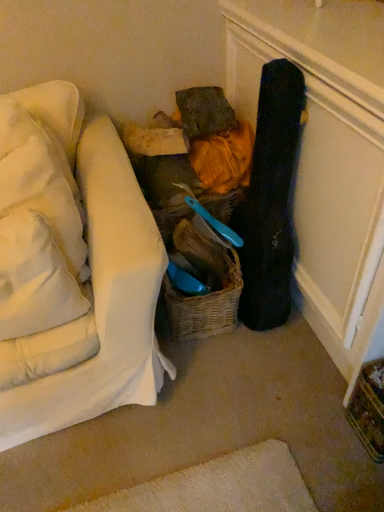
What is the approximate width of woven brown basket at center, placed as the first basket when sorted from top to bottom?

woven brown basket at center, placed as the first basket when sorted from top to bottom, is 8.31 inches in width.

In order to face woven brown basket at center, placed as the first basket when sorted from bottom to top, should I rotate leftwards or rightwards?

Turn right approximately 0.980 degrees to face it.

Describe the element at coordinates (34, 279) in the screenshot. I see `white soft pillow at left, positioned as the third pillow in top-to-bottom order` at that location.

Image resolution: width=384 pixels, height=512 pixels. Identify the location of white soft pillow at left, arranged as the 2th pillow when ordered from the bottom. (40, 179).

Measure the distance between white soft pillow at left, arranged as the 2th pillow when ordered from the bottom, and camera.

3.37 feet.

Find the location of a particular element. woven brown basket at center, placed as the first basket when sorted from top to bottom is located at coordinates (221, 203).

From the image's perspective, is woven brown basket at center, placed as the first basket when sorted from bottom to top, above or below white soft pillow at upper left, which is counted as the 1th pillow, starting from the top?

From the image's perspective, woven brown basket at center, placed as the first basket when sorted from bottom to top, appears below white soft pillow at upper left, which is counted as the 1th pillow, starting from the top.

From a real-world perspective, between woven brown basket at center, placed as the 2th basket when sorted from top to bottom, and white soft pillow at upper left, which is counted as the 1th pillow, starting from the top, who is vertically lower?

woven brown basket at center, placed as the 2th basket when sorted from top to bottom, from a real-world perspective.

Is woven brown basket at center, placed as the first basket when sorted from bottom to top, facing away from white soft pillow at upper left, the third pillow from the bottom?

No.

Who is bigger, woven brown basket at center, placed as the first basket when sorted from bottom to top, or white soft pillow at upper left, which is counted as the 1th pillow, starting from the top?

Bigger between the two is woven brown basket at center, placed as the first basket when sorted from bottom to top.

Looking at the image, does white soft pillow at left, positioned as the third pillow in top-to-bottom order, seem bigger or smaller compared to woven brown basket at center, placed as the first basket when sorted from top to bottom?

In the image, white soft pillow at left, positioned as the third pillow in top-to-bottom order, appears to be larger than woven brown basket at center, placed as the first basket when sorted from top to bottom.

Is white soft pillow at left, positioned as the third pillow in top-to-bottom order, turned away from woven brown basket at center, marked as the second basket in a bottom-to-top arrangement?

white soft pillow at left, positioned as the third pillow in top-to-bottom order, does not have its back to woven brown basket at center, marked as the second basket in a bottom-to-top arrangement.

What's the angular difference between white soft pillow at left, positioned as the third pillow in top-to-bottom order, and woven brown basket at center, marked as the second basket in a bottom-to-top arrangement,'s facing directions?

There is a 4.85-degree angle between the facing directions of white soft pillow at left, positioned as the third pillow in top-to-bottom order, and woven brown basket at center, marked as the second basket in a bottom-to-top arrangement.

Is point (21, 236) closer to camera compared to point (168, 222)?

That is True.

Which is closer to the camera, (x=82, y=106) or (x=172, y=210)?

Point (x=82, y=106) is positioned farther from the camera compared to point (x=172, y=210).

Is white soft pillow at upper left, which is counted as the 1th pillow, starting from the top, looking in the opposite direction of woven brown basket at center, marked as the second basket in a bottom-to-top arrangement?

white soft pillow at upper left, which is counted as the 1th pillow, starting from the top, does not have its back to woven brown basket at center, marked as the second basket in a bottom-to-top arrangement.

How far apart are white soft pillow at upper left, the third pillow from the bottom, and woven brown basket at center, placed as the first basket when sorted from top to bottom?

17.81 inches.

Between white soft pillow at upper left, the third pillow from the bottom, and woven brown basket at center, placed as the first basket when sorted from top to bottom, which one has less height?

Standing shorter between the two is woven brown basket at center, placed as the first basket when sorted from top to bottom.

Is white soft pillow at left, positioned as the third pillow in top-to-bottom order, to the right of white soft pillow at upper left, the third pillow from the bottom, from the viewer's perspective?

Indeed, white soft pillow at left, positioned as the third pillow in top-to-bottom order, is positioned on the right side of white soft pillow at upper left, the third pillow from the bottom.

Is the depth of white soft pillow at left, positioned as the third pillow in top-to-bottom order, less than that of white soft pillow at upper left, the third pillow from the bottom?

Yes.

From the image's perspective, which one is positioned lower, white soft pillow at left, positioned as the third pillow in top-to-bottom order, or white soft pillow at upper left, which is counted as the 1th pillow, starting from the top?

white soft pillow at left, positioned as the third pillow in top-to-bottom order, is shown below in the image.

Does point (65, 286) come behind point (67, 146)?

No, it is not.

Is white soft pillow at upper left, the third pillow from the bottom, not within white soft pillow at left, positioned as the 2th pillow in top-to-bottom order?

white soft pillow at upper left, the third pillow from the bottom, lies outside white soft pillow at left, positioned as the 2th pillow in top-to-bottom order,'s area.

From the image's perspective, which is above, white soft pillow at upper left, which is counted as the 1th pillow, starting from the top, or white soft pillow at left, arranged as the 2th pillow when ordered from the bottom?

white soft pillow at upper left, which is counted as the 1th pillow, starting from the top, appears higher in the image.

Is point (55, 111) positioned behind point (9, 198)?

Yes.

What's the angular difference between white soft pillow at upper left, which is counted as the 1th pillow, starting from the top, and white soft pillow at left, positioned as the 2th pillow in top-to-bottom order,'s facing directions?

There is a 0.000384-degree angle between the facing directions of white soft pillow at upper left, which is counted as the 1th pillow, starting from the top, and white soft pillow at left, positioned as the 2th pillow in top-to-bottom order.

Does point (45, 135) come in front of point (191, 215)?

That is True.

From the image's perspective, which is below, white soft pillow at left, positioned as the 2th pillow in top-to-bottom order, or woven brown basket at center, placed as the first basket when sorted from top to bottom?

white soft pillow at left, positioned as the 2th pillow in top-to-bottom order.

Which of these two, white soft pillow at left, arranged as the 2th pillow when ordered from the bottom, or woven brown basket at center, marked as the second basket in a bottom-to-top arrangement, is bigger?

white soft pillow at left, arranged as the 2th pillow when ordered from the bottom, is bigger.

Visually, is white soft pillow at left, positioned as the 2th pillow in top-to-bottom order, positioned to the left or to the right of woven brown basket at center, marked as the second basket in a bottom-to-top arrangement?

In the image, white soft pillow at left, positioned as the 2th pillow in top-to-bottom order, appears on the left side of woven brown basket at center, marked as the second basket in a bottom-to-top arrangement.

Identify the location of clothing below the white soft pillow at upper left, which is counted as the 1th pillow, starting from the top (from a real-world perspective). (271, 199).

Is black matte guitar case at right completely or partially outside of white soft pillow at upper left, the third pillow from the bottom?

Yes, black matte guitar case at right is outside of white soft pillow at upper left, the third pillow from the bottom.

Considering the points (257, 138) and (36, 98), which point is in front, point (257, 138) or point (36, 98)?

The point (257, 138) is closer to the camera.

Considering the positions of objects black matte guitar case at right and white soft pillow at upper left, the third pillow from the bottom, in the image provided, who is more to the left, black matte guitar case at right or white soft pillow at upper left, the third pillow from the bottom,?

white soft pillow at upper left, the third pillow from the bottom.

This screenshot has width=384, height=512. I want to click on the 2nd basket counting from the right side of the white soft pillow at upper left, the third pillow from the bottom, so click(x=206, y=305).

This screenshot has height=512, width=384. There is a white soft pillow at left, marked as the first pillow in a bottom-to-top arrangement. Find the location of `the 1st basket below it (from a real-world perspective)`. the 1st basket below it (from a real-world perspective) is located at coordinates (221, 203).

Based on their spatial positions, is white soft pillow at left, positioned as the 2th pillow in top-to-bottom order, or woven brown basket at center, placed as the first basket when sorted from bottom to top, closer to woven brown basket at center, marked as the second basket in a bottom-to-top arrangement?

woven brown basket at center, placed as the first basket when sorted from bottom to top, is closer to woven brown basket at center, marked as the second basket in a bottom-to-top arrangement.

From the image, which object appears to be nearer to white soft pillow at left, positioned as the third pillow in top-to-bottom order, black matte guitar case at right or white soft pillow at left, positioned as the 2th pillow in top-to-bottom order?

Among the two, white soft pillow at left, positioned as the 2th pillow in top-to-bottom order, is located nearer to white soft pillow at left, positioned as the third pillow in top-to-bottom order.

Estimate the real-world distances between objects in this image. Which object is closer to woven brown basket at center, placed as the first basket when sorted from bottom to top, black matte guitar case at right or woven brown basket at center, marked as the second basket in a bottom-to-top arrangement?

The object closer to woven brown basket at center, placed as the first basket when sorted from bottom to top, is black matte guitar case at right.

Considering their positions, is woven brown basket at center, placed as the first basket when sorted from top to bottom, positioned further to woven brown basket at center, placed as the first basket when sorted from bottom to top, than white soft pillow at upper left, which is counted as the 1th pillow, starting from the top?

white soft pillow at upper left, which is counted as the 1th pillow, starting from the top, is further to woven brown basket at center, placed as the first basket when sorted from bottom to top.

Based on their spatial positions, is white soft pillow at left, marked as the first pillow in a bottom-to-top arrangement, or white soft pillow at left, positioned as the 2th pillow in top-to-bottom order, further from woven brown basket at center, placed as the first basket when sorted from top to bottom?

The object further to woven brown basket at center, placed as the first basket when sorted from top to bottom, is white soft pillow at left, marked as the first pillow in a bottom-to-top arrangement.

Which object lies further to the anchor point woven brown basket at center, placed as the first basket when sorted from bottom to top, woven brown basket at center, placed as the first basket when sorted from top to bottom, or white soft pillow at left, marked as the first pillow in a bottom-to-top arrangement?

white soft pillow at left, marked as the first pillow in a bottom-to-top arrangement.

Estimate the real-world distances between objects in this image. Which object is closer to woven brown basket at center, marked as the second basket in a bottom-to-top arrangement, black matte guitar case at right or white soft pillow at left, positioned as the 2th pillow in top-to-bottom order?

Based on the image, black matte guitar case at right appears to be nearer to woven brown basket at center, marked as the second basket in a bottom-to-top arrangement.

From the image, which object appears to be nearer to white soft pillow at left, positioned as the 2th pillow in top-to-bottom order, woven brown basket at center, marked as the second basket in a bottom-to-top arrangement, or black matte guitar case at right?

Based on the image, woven brown basket at center, marked as the second basket in a bottom-to-top arrangement, appears to be nearer to white soft pillow at left, positioned as the 2th pillow in top-to-bottom order.

Find the location of a particular element. Image resolution: width=384 pixels, height=512 pixels. basket between black matte guitar case at right and woven brown basket at center, marked as the second basket in a bottom-to-top arrangement, from front to back is located at coordinates (206, 305).

Where is `basket between white soft pillow at upper left, which is counted as the 1th pillow, starting from the top, and woven brown basket at center, placed as the 2th basket when sorted from top to bottom`? basket between white soft pillow at upper left, which is counted as the 1th pillow, starting from the top, and woven brown basket at center, placed as the 2th basket when sorted from top to bottom is located at coordinates pyautogui.click(x=221, y=203).

Locate an element on the screen. Image resolution: width=384 pixels, height=512 pixels. clothing located between white soft pillow at left, positioned as the third pillow in top-to-bottom order, and woven brown basket at center, marked as the second basket in a bottom-to-top arrangement, in the depth direction is located at coordinates (271, 199).

Locate an element on the screen. basket between white soft pillow at left, arranged as the 2th pillow when ordered from the bottom, and woven brown basket at center, marked as the second basket in a bottom-to-top arrangement, from front to back is located at coordinates pyautogui.click(x=206, y=305).